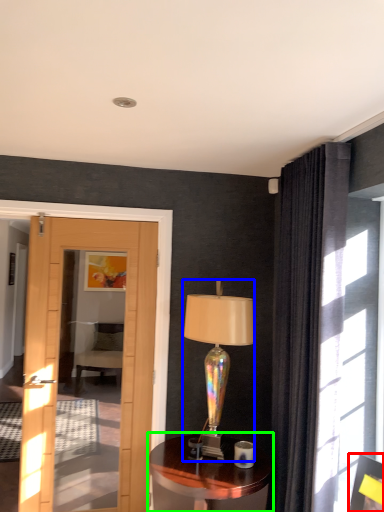
Question: Estimate the real-world distances between objects in this image. Which object is closer to picture frame (highlighted by a red box), lamp (highlighted by a blue box) or table (highlighted by a green box)?

Choices:
 (A) lamp
 (B) table

Answer: (B)